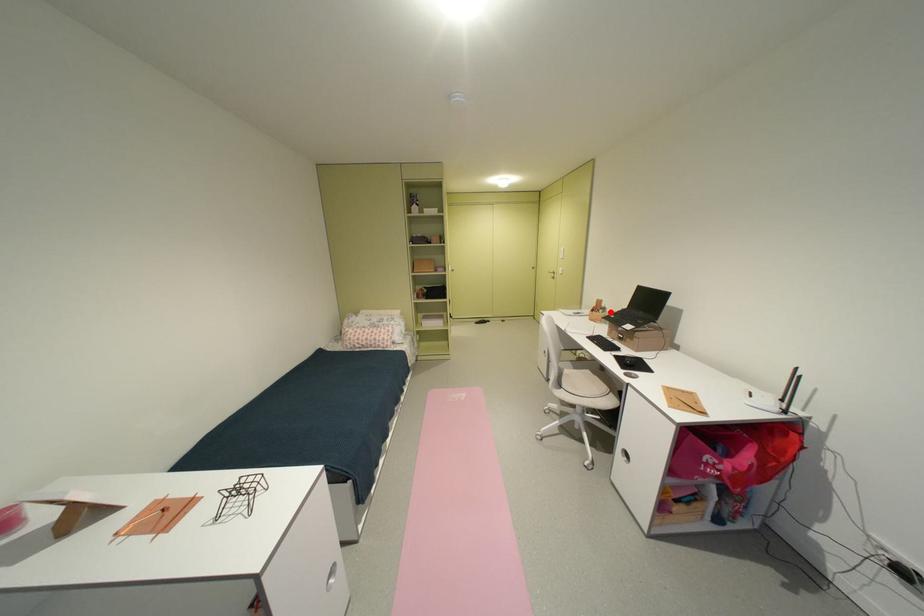
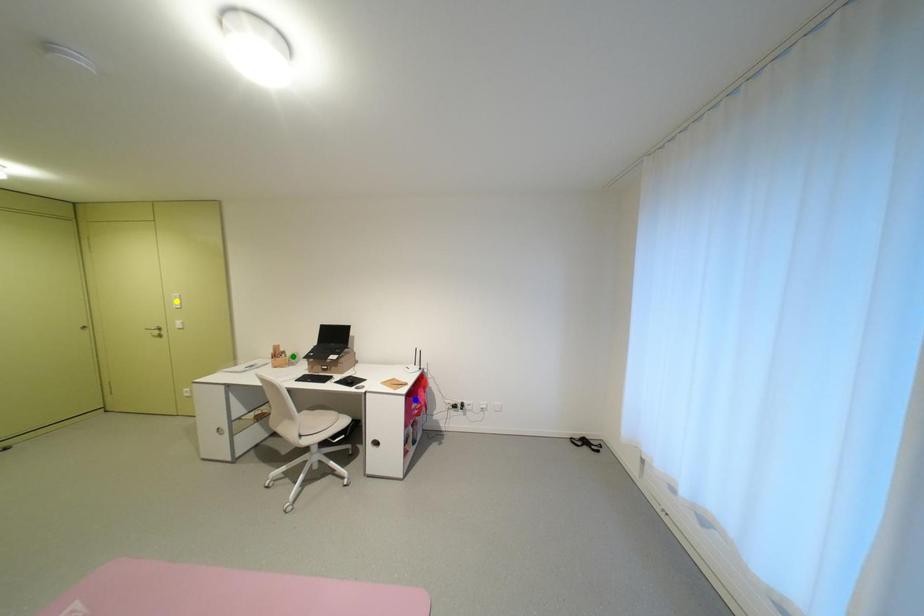
Question: I am providing you with two images of the same scene from different viewpoints. A red point is marked on the first image. You are given multiple points on the second image. Which point in image 2 is actually the same real-world point as the red point in image 1?

Choices:
 (A) green point
 (B) blue point
 (C) yellow point

Answer: (A)